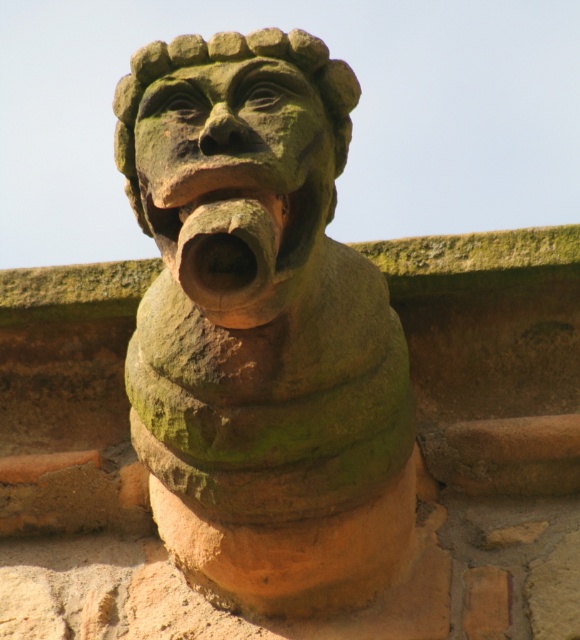
You are standing at the base of a building and looking up at the green stone gargoyle at center. If you want to take a photo of it with your smartphone camera, which has a maximum zoom range of 5 meters, will you be able to capture the entire gargoyle in the frame without moving closer?

The green stone gargoyle at center is 6.76 meters away from you. Since your smartphone camera has a maximum zoom range of 5 meters, you won not be able to capture the entire gargoyle in the frame without moving closer.

Based on the photo, you are an architect assessing the structural integrity of the green stone gargoyle at center and the earthy clay mouth at center. Which object has a greater width?

The green stone gargoyle at center has a greater width than the earthy clay mouth at center.

You are an architect inspecting the building roof. You see the green stone gargoyle at center and the earthy clay mouth at center. Which object is taller?

The green stone gargoyle at center is much taller than the earthy clay mouth at center.